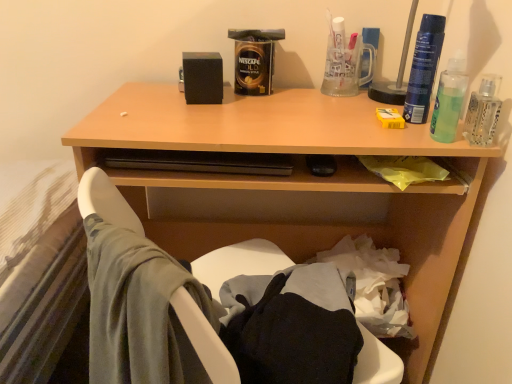
Image resolution: width=512 pixels, height=384 pixels. I want to click on free spot to the left of clear glass bottle at upper right, which appears as the 2th bottle when viewed from the left, so click(x=382, y=130).